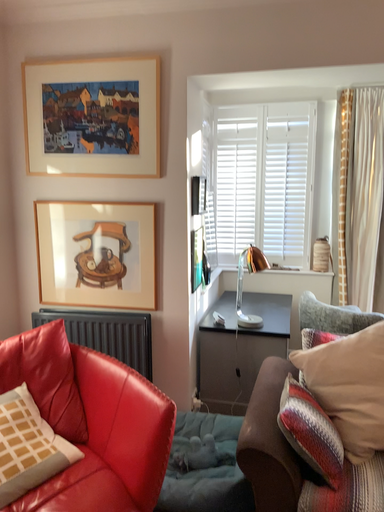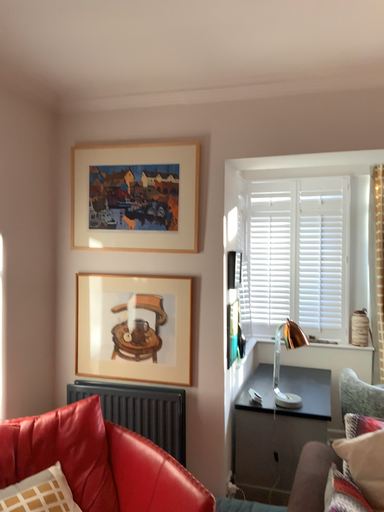
Question: Which way did the camera rotate in the video?

Choices:
 (A) rotated downward
 (B) rotated upward

Answer: (B)